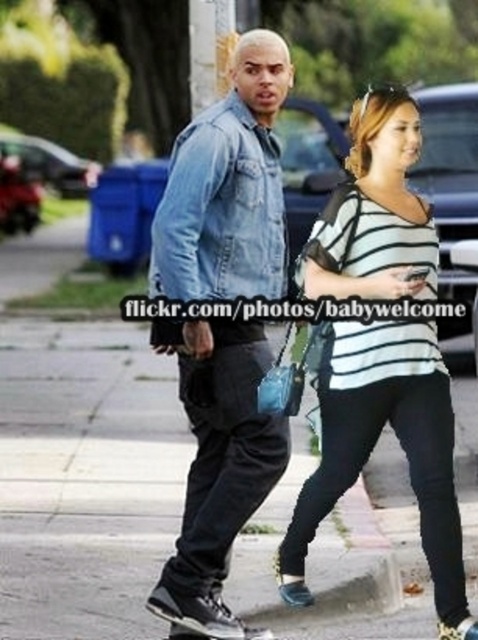
Can you confirm if denim jacket at center is positioned below striped jersey at center?

No, denim jacket at center is not below striped jersey at center.

Is point (238, 280) more distant than point (345, 476)?

No, it is in front of (345, 476).

Where is `denim jacket at center`? denim jacket at center is located at coordinates (228, 188).

Is point (270, 504) less distant than point (271, 449)?

No, it is behind (271, 449).

Consider the image. Who is higher up, gray concrete sidewalk at center or denim jacket at center?

denim jacket at center is higher up.

Who is more forward, (161, 397) or (203, 563)?

Point (203, 563) is more forward.

Locate an element on the screen. This screenshot has height=640, width=478. gray concrete sidewalk at center is located at coordinates (86, 477).

Can you confirm if gray concrete sidewalk at center is positioned below striped jersey at center?

Yes, gray concrete sidewalk at center is below striped jersey at center.

Which of these two, gray concrete sidewalk at center or striped jersey at center, stands taller?

With more height is striped jersey at center.

Find the location of `gray concrete sidewalk at center`. gray concrete sidewalk at center is located at coordinates (86, 477).